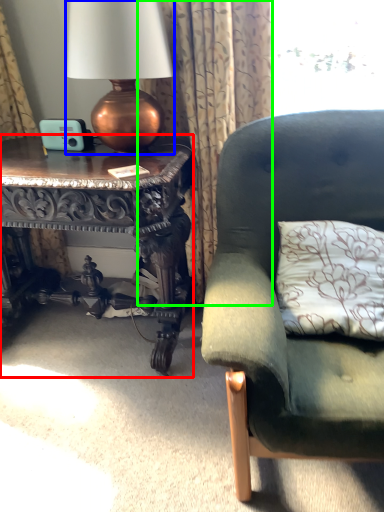
Question: Considering the real-world distances, which object is closest to table (highlighted by a red box)? lamp (highlighted by a blue box) or curtain (highlighted by a green box).

Choices:
 (A) lamp
 (B) curtain

Answer: (B)